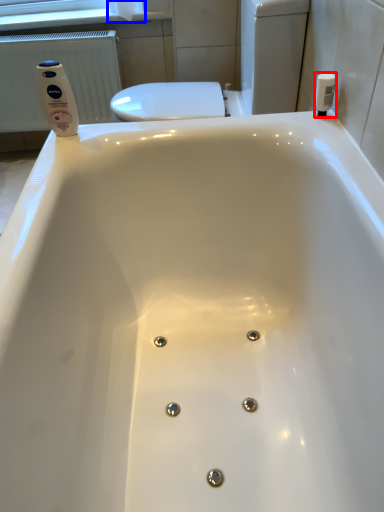
Question: Which point is further to the camera, toiletry (highlighted by a red box) or toilet paper (highlighted by a blue box)?

Choices:
 (A) toiletry
 (B) toilet paper

Answer: (B)